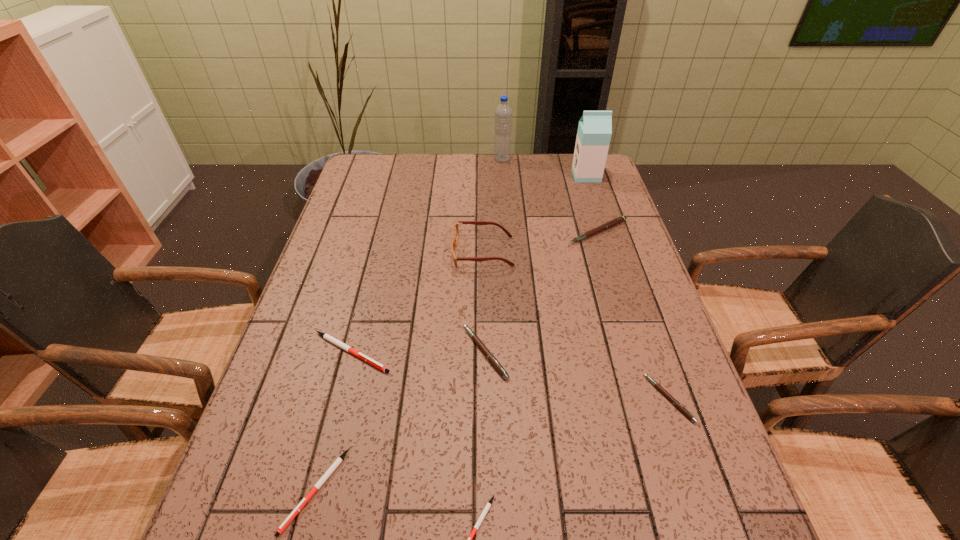
I want to click on the farthest object, so click(503, 112).

Image resolution: width=960 pixels, height=540 pixels. What are the coordinates of `water bottle` in the screenshot? It's located at (503, 112).

Find the location of a particular element. the second farthest object is located at coordinates (594, 132).

Where is `milk carton`? The height and width of the screenshot is (540, 960). milk carton is located at coordinates pyautogui.click(x=594, y=132).

Find the location of a particular element. This screenshot has width=960, height=540. brown spectacles is located at coordinates point(455,230).

The height and width of the screenshot is (540, 960). Identify the location of the seventh shortest object. (455, 230).

The height and width of the screenshot is (540, 960). Identify the location of the tallest pen. (609, 224).

At what (x,y) coordinates should I click in order to perform the action: click on the sixth shortest object. Please return your answer as a coordinate pair (x, y). This screenshot has height=540, width=960. Looking at the image, I should click on (609, 224).

Where is `the leftmost pink pen`? This screenshot has height=540, width=960. the leftmost pink pen is located at coordinates (480, 344).

The height and width of the screenshot is (540, 960). Find the location of `the biggest white pen`. the biggest white pen is located at coordinates (326, 336).